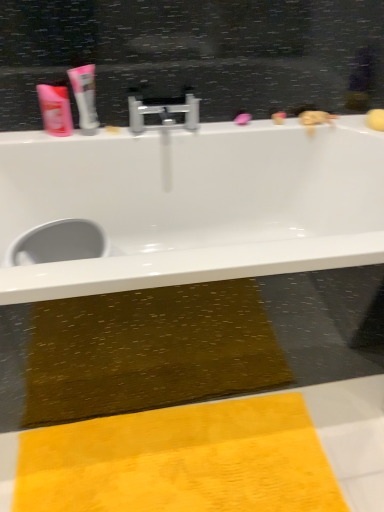
Question: Which is correct: pink plastic shampoo at upper left is inside silver metallic faucet at center, or outside of it?

Choices:
 (A) outside
 (B) inside

Answer: (A)

Question: Does point (56, 93) appear closer or farther from the camera than point (165, 108)?

Choices:
 (A) farther
 (B) closer

Answer: (B)

Question: Estimate the real-world distances between objects in this image. Which object is closer to the yellow textured towel at lower center?

Choices:
 (A) white glossy tube at upper left
 (B) silver metallic faucet at center
 (C) pink plastic shampoo at upper left
 (D) white glossy bathtub at upper center

Answer: (D)

Question: Estimate the real-world distances between objects in this image. Which object is closer to the yellow textured towel at lower center?

Choices:
 (A) pink plastic shampoo at upper left
 (B) white glossy tube at upper left
 (C) white glossy bathtub at upper center
 (D) silver metallic faucet at center

Answer: (C)